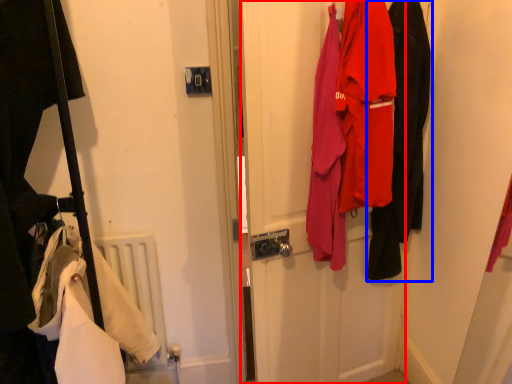
Question: Which of the following is the closest to the observer, door (highlighted by a red box) or clothing (highlighted by a blue box)?

Choices:
 (A) door
 (B) clothing

Answer: (A)